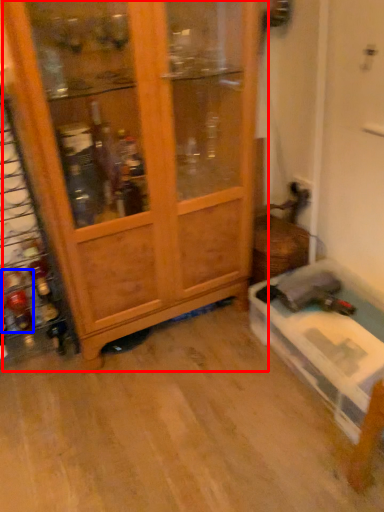
Question: Which point is closer to the camera, cupboard (highlighted by a red box) or bottle (highlighted by a blue box)?

Choices:
 (A) cupboard
 (B) bottle

Answer: (A)